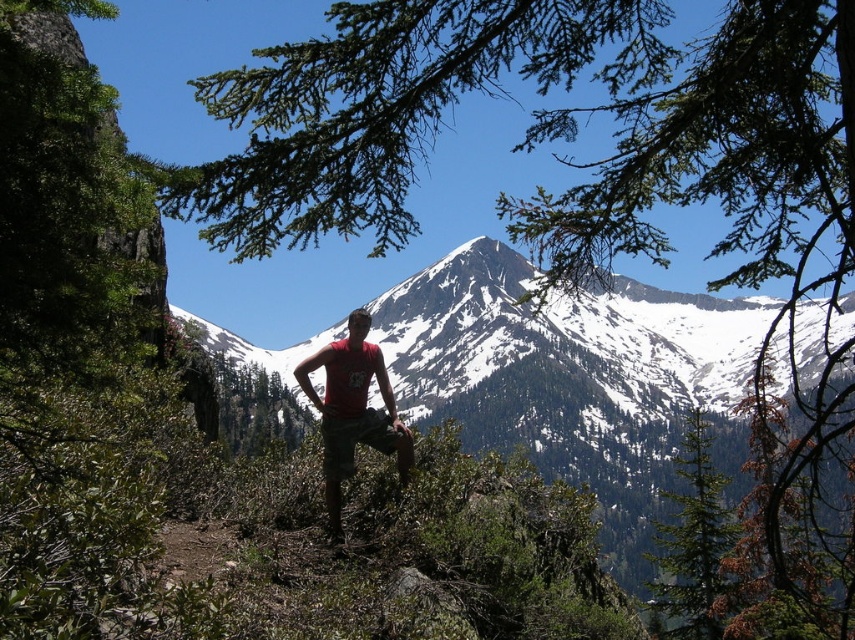
Question: Considering the relative positions of snowy granite peak at center and matte red t-shirt at center in the image provided, where is snowy granite peak at center located with respect to matte red t-shirt at center?

Choices:
 (A) right
 (B) left

Answer: (A)

Question: Which object appears closest to the camera in this image?

Choices:
 (A) green textured tree at center
 (B) matte red t-shirt at center

Answer: (B)

Question: Which of these objects is positioned closest to the matte red t-shirt at center?

Choices:
 (A) green textured tree at center
 (B) snowy granite peak at center

Answer: (B)

Question: Does green textured tree at center have a lesser width compared to matte red t-shirt at center?

Choices:
 (A) yes
 (B) no

Answer: (B)

Question: Which point is closer to the camera?

Choices:
 (A) (370, 369)
 (B) (657, 524)
 (C) (408, 328)

Answer: (A)

Question: Can you confirm if green textured tree at center is positioned below matte red t-shirt at center?

Choices:
 (A) no
 (B) yes

Answer: (B)